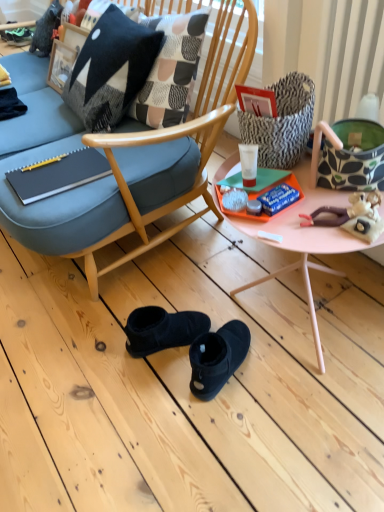
Where is `patterned fabric handbag at upper right, which is counted as the first handbag, starting from the left`? patterned fabric handbag at upper right, which is counted as the first handbag, starting from the left is located at coordinates (282, 123).

This screenshot has height=512, width=384. I want to click on pink plastic tray at center, so click(x=304, y=241).

What do you see at coordinates (304, 241) in the screenshot?
I see `pink plastic tray at center` at bounding box center [304, 241].

Find the location of `green suede sneakers at upper left`. green suede sneakers at upper left is located at coordinates (18, 34).

What is the approximate width of green suede sneakers at upper left?

green suede sneakers at upper left is 33.53 centimeters in width.

The width and height of the screenshot is (384, 512). Identify the location of plush doll at right. (351, 216).

What are the coordinates of `green fabric handbag at right, the second handbag viewed from the left` in the screenshot? It's located at (349, 156).

Is matte black notebook at left turned away from white glossy cream at center?

No, white glossy cream at center is not at the back of matte black notebook at left.

From a real-world perspective, is matte black notebook at left beneath white glossy cream at center?

Correct, in the physical world, matte black notebook at left is lower than white glossy cream at center.

Considering the sizes of matte black notebook at left and white glossy cream at center in the image, is matte black notebook at left bigger or smaller than white glossy cream at center?

matte black notebook at left is bigger than white glossy cream at center.

Locate an element on the screen. The height and width of the screenshot is (512, 384). pillow that is above the plush doll at right (from the image's perspective) is located at coordinates (110, 69).

Can you confirm if black woolen pillow at upper left is thinner than plush doll at right?

Yes.

Is black woolen pillow at upper left facing away from plush doll at right?

black woolen pillow at upper left is not turned away from plush doll at right.

Considering the sizes of objects pink plastic tray at center and matte black notebook at left in the image provided, who is taller, pink plastic tray at center or matte black notebook at left?

Standing taller between the two is pink plastic tray at center.

Who is smaller, pink plastic tray at center or matte black notebook at left?

With smaller size is matte black notebook at left.

How far apart are pink plastic tray at center and matte black notebook at left?

pink plastic tray at center and matte black notebook at left are 22.70 inches apart.

Considering the positions of points (242, 223) and (69, 184), is point (242, 223) closer to camera compared to point (69, 184)?

Yes, point (242, 223) is closer to viewer.

Which point is more distant from viewer, (x=363, y=159) or (x=98, y=98)?

Point (x=98, y=98)

Which is more to the right, green fabric handbag at right, positioned as the first handbag in right-to-left order, or black woolen pillow at upper left?

green fabric handbag at right, positioned as the first handbag in right-to-left order, is more to the right.

Between green fabric handbag at right, the second handbag viewed from the left, and black woolen pillow at upper left, which one is positioned behind?

black woolen pillow at upper left.

Considering the positions of objects black woolen pillow at upper left and matte black notebook at left in the image provided, who is more to the right, black woolen pillow at upper left or matte black notebook at left?

From the viewer's perspective, black woolen pillow at upper left appears more on the right side.

From their relative heights in the image, would you say black woolen pillow at upper left is taller or shorter than matte black notebook at left?

Clearly, black woolen pillow at upper left is taller compared to matte black notebook at left.

How distant is black woolen pillow at upper left from matte black notebook at left?

black woolen pillow at upper left and matte black notebook at left are 13.86 inches apart from each other.

Is black woolen pillow at upper left facing towards matte black notebook at left?

Yes, black woolen pillow at upper left is oriented towards matte black notebook at left.

Choose the correct answer: Is plush doll at right inside black woolen pillow at upper left or outside it?

plush doll at right is not inside black woolen pillow at upper left, it's outside.

From the image's perspective, which one is positioned lower, plush doll at right or black woolen pillow at upper left?

plush doll at right.

From a real-world perspective, is plush doll at right above or below black woolen pillow at upper left?

Clearly, from a real-world perspective, plush doll at right is above black woolen pillow at upper left.

Considering the positions of objects plush doll at right and black woolen pillow at upper left in the image provided, who is more to the left, plush doll at right or black woolen pillow at upper left?

black woolen pillow at upper left is more to the left.

Considering their positions, is black woolen pillow at upper left located in front of or behind green fabric handbag at right, the second handbag viewed from the left?

Visually, black woolen pillow at upper left is located behind green fabric handbag at right, the second handbag viewed from the left.

From a real-world perspective, is black woolen pillow at upper left above or below green fabric handbag at right, the second handbag viewed from the left?

From a real-world perspective, black woolen pillow at upper left is physically below green fabric handbag at right, the second handbag viewed from the left.

Looking at this image, does black woolen pillow at upper left have a greater height compared to green fabric handbag at right, the second handbag viewed from the left?

Yes, black woolen pillow at upper left is taller than green fabric handbag at right, the second handbag viewed from the left.

From the image's perspective, who appears lower, black woolen pillow at upper left or green fabric handbag at right, the second handbag viewed from the left?

green fabric handbag at right, the second handbag viewed from the left, is shown below in the image.

Locate an element on the screen. coffee cup that is above the matte black notebook at left (from a real-world perspective) is located at coordinates (248, 163).

Find the location of a particular element. stuff below the black woolen pillow at upper left (from the image's perspective) is located at coordinates (351, 216).

Considering their positions, is patterned fabric handbag at upper right, which is counted as the first handbag, starting from the left, positioned closer to white glossy cream at center than plush doll at right?

The object closer to white glossy cream at center is patterned fabric handbag at upper right, which is counted as the first handbag, starting from the left.

Considering their positions, is white glossy cream at center positioned further to matte black notebook at left than green suede sneakers at upper left?

green suede sneakers at upper left is further to matte black notebook at left.

Which object lies nearer to the anchor point patterned fabric handbag at upper right, acting as the 2th handbag starting from the right, black woolen pillow at upper left or green suede sneakers at upper left?

black woolen pillow at upper left is positioned closer to the anchor patterned fabric handbag at upper right, acting as the 2th handbag starting from the right.

Based on the photo, estimate the real-world distances between objects in this image. Which object is closer to patterned fabric handbag at upper right, which is counted as the first handbag, starting from the left, plush doll at right or white glossy cream at center?

white glossy cream at center.

When comparing their distances from plush doll at right, does green fabric handbag at right, the second handbag viewed from the left, or patterned fabric handbag at upper right, which is counted as the first handbag, starting from the left, seem further?

Based on the image, patterned fabric handbag at upper right, which is counted as the first handbag, starting from the left, appears to be further to plush doll at right.

From the image, which object appears to be nearer to white glossy cream at center, black woolen pillow at upper left or green suede sneakers at upper left?

black woolen pillow at upper left is closer to white glossy cream at center.

When comparing their distances from white glossy cream at center, does black woolen pillow at upper left or patterned fabric handbag at upper right, which is counted as the first handbag, starting from the left, seem further?

The object further to white glossy cream at center is black woolen pillow at upper left.

Estimate the real-world distances between objects in this image. Which object is further from black woolen pillow at upper left, patterned fabric handbag at upper right, which is counted as the first handbag, starting from the left, or green suede sneakers at upper left?

The object further to black woolen pillow at upper left is green suede sneakers at upper left.

I want to click on handbag between white glossy cream at center and green fabric handbag at right, positioned as the first handbag in right-to-left order, from left to right, so click(x=282, y=123).

Locate an element on the screen. The image size is (384, 512). pillow situated between matte black notebook at left and white glossy cream at center from left to right is located at coordinates (110, 69).

Where is `desk located between matte black notebook at left and plush doll at right in the left-right direction`? The image size is (384, 512). desk located between matte black notebook at left and plush doll at right in the left-right direction is located at coordinates (304, 241).

Identify the location of stuff between black woolen pillow at upper left and pink plastic tray at center in the vertical direction. The width and height of the screenshot is (384, 512). (351, 216).